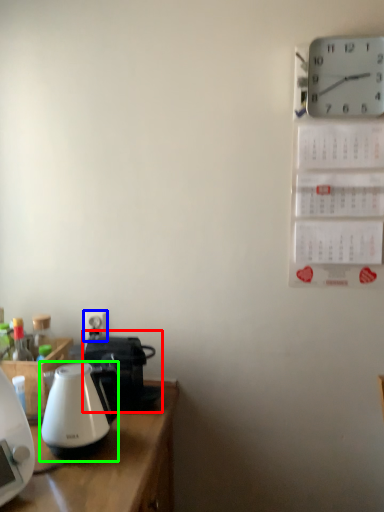
Question: Considering the real-world distances, which object is closest to coffeepot (highlighted by a red box)? electric outlet (highlighted by a blue box) or kettle (highlighted by a green box).

Choices:
 (A) electric outlet
 (B) kettle

Answer: (B)